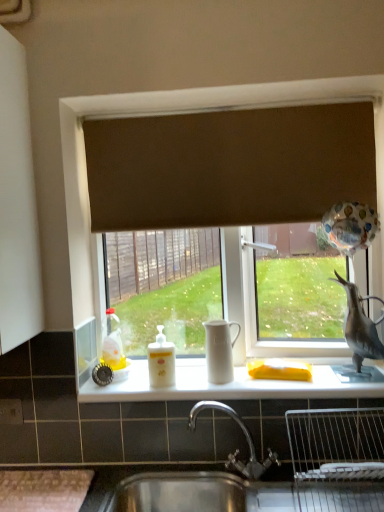
Question: From a real-world perspective, is gray matte bird at right physically located above or below translucent plastic bottle at left?

Choices:
 (A) below
 (B) above

Answer: (B)

Question: Is gray matte bird at right situated inside translucent plastic bottle at left or outside?

Choices:
 (A) inside
 (B) outside

Answer: (B)

Question: Considering the real-world distances, which object is farthest from the white glossy counter top at center?

Choices:
 (A) translucent plastic bottle at left
 (B) gray matte bird at right
 (C) white glossy bottle at center
 (D) brown fabric curtain at upper center
 (E) white matte tea pot at center

Answer: (D)

Question: Which object is the closest to the white glossy bottle at center?

Choices:
 (A) white glossy counter top at center
 (B) gray matte bird at right
 (C) translucent plastic bottle at left
 (D) white matte tea pot at center
 (E) brown fabric curtain at upper center

Answer: (C)